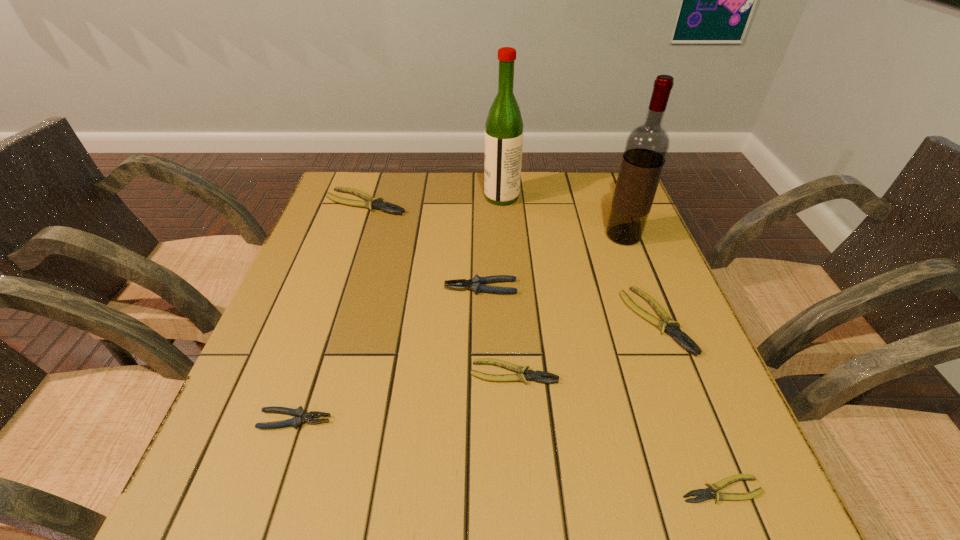
Where is `green liquor`? This screenshot has height=540, width=960. green liquor is located at coordinates (504, 127).

Locate an element on the screen. wine bottle is located at coordinates (646, 148).

You are a GUI agent. You are given a task and a screenshot of the screen. Output one action in this format:
    pyautogui.click(x=<x>, y=<y>)
    Task: Click on the right gray pliers
    
    Given the screenshot: What is the action you would take?
    pyautogui.click(x=475, y=284)

I want to click on the bigger gray pliers, so click(x=475, y=284).

The width and height of the screenshot is (960, 540). Identify the location of the biggest yellow pliers. (371, 202).

Where is `the farthest yellow pliers`? The width and height of the screenshot is (960, 540). the farthest yellow pliers is located at coordinates (371, 202).

Find the location of a particular element. the second farthest yellow pliers is located at coordinates (667, 324).

Locate an element on the screen. the left gray pliers is located at coordinates (301, 416).

Locate an element on the screen. The image size is (960, 540). the nearer gray pliers is located at coordinates (301, 416).

Find the location of a particular element. This screenshot has width=960, height=540. the third biggest yellow pliers is located at coordinates (531, 375).